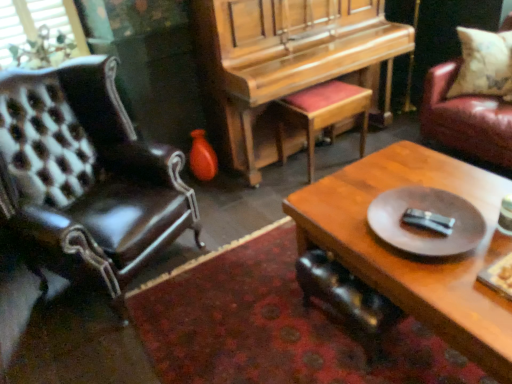
At what (x,y) coordinates should I click in order to perform the action: click on vacant space in front of black plastic remote control at center. Please return your answer as a coordinate pair (x, y). The width and height of the screenshot is (512, 384). Looking at the image, I should click on (442, 274).